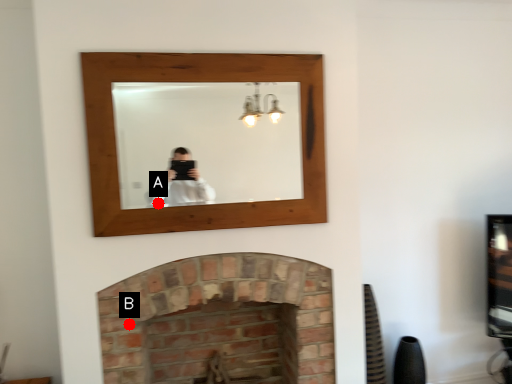
Question: Two points are circled on the image, labeled by A and B beside each circle. Which point appears farthest from the camera in this image?

Choices:
 (A) A is further
 (B) B is further

Answer: (A)